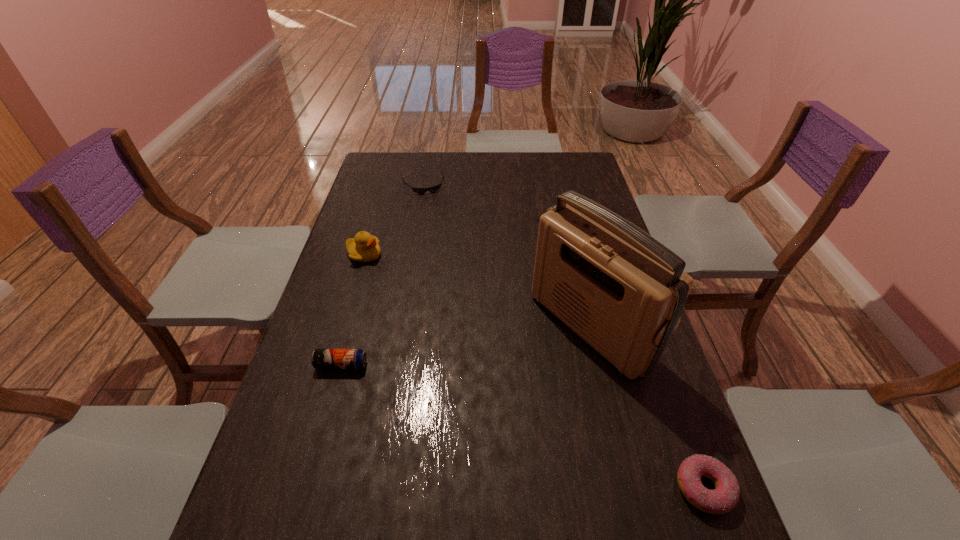
In order to click on beer can that is at the left edge in this screenshot , I will do `click(321, 358)`.

Locate an element on the screen. duckling present at the left edge is located at coordinates (364, 248).

Find the location of a particular element. sunglasses situated at the left edge is located at coordinates (432, 189).

I want to click on doughnut present at the right edge, so click(x=725, y=496).

You are a GUI agent. You are given a task and a screenshot of the screen. Output one action in this format:
    pyautogui.click(x=<x>, y=<y>)
    Task: Click on the radio receiver positioned at the right edge
    The image size is (960, 540).
    Given the screenshot: What is the action you would take?
    pyautogui.click(x=622, y=291)

Identify the location of object present at the far left corner. (432, 189).

Where is `object that is at the near right corner`? This screenshot has width=960, height=540. object that is at the near right corner is located at coordinates (725, 496).

Locate an element on the screen. This screenshot has width=960, height=540. vacant area at the far edge is located at coordinates (517, 167).

Find the location of a particular element. This screenshot has width=960, height=540. free space at the near edge of the desktop is located at coordinates (596, 478).

The height and width of the screenshot is (540, 960). Identify the location of free region at the left edge of the desktop. (340, 416).